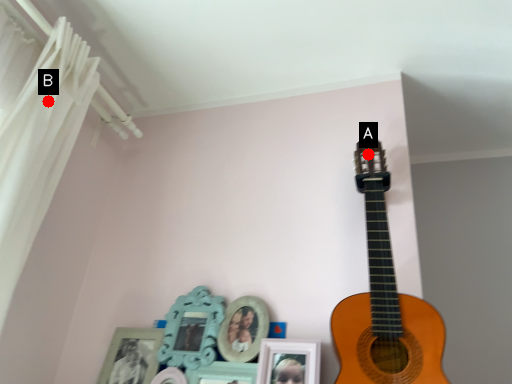
Question: Two points are circled on the image, labeled by A and B beside each circle. Which point is farther to the camera?

Choices:
 (A) A is further
 (B) B is further

Answer: (A)